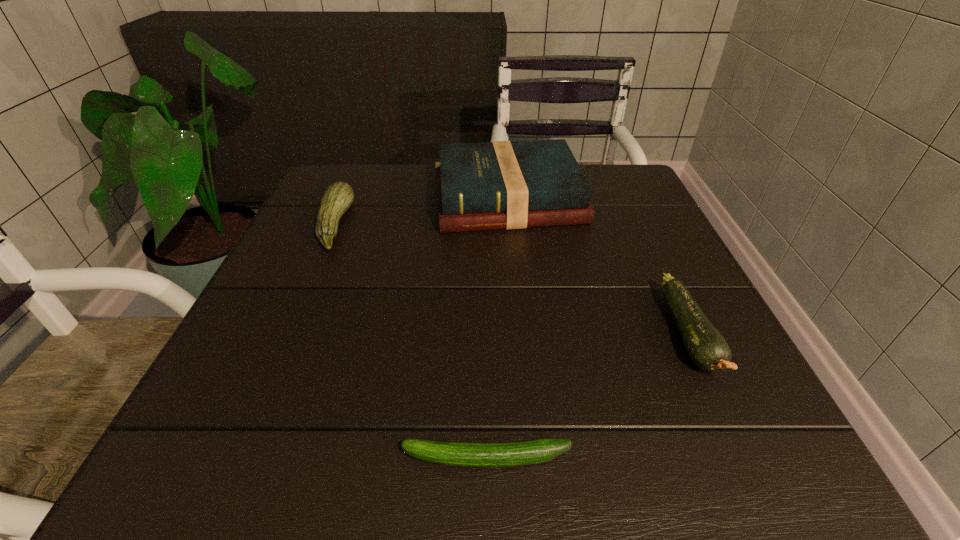
Where is `free space located 0.310m on the front-facing side of the shortest object`? free space located 0.310m on the front-facing side of the shortest object is located at coordinates coord(164,458).

At what (x,y) coordinates should I click in order to perform the action: click on blank area located on the front-facing side of the shortest object. Please return your answer as a coordinate pair (x, y). The height and width of the screenshot is (540, 960). Looking at the image, I should click on (210, 458).

At what (x,y) coordinates should I click in order to perform the action: click on free region located on the front-facing side of the shortest object. Please return your answer as a coordinate pair (x, y). This screenshot has height=540, width=960. Looking at the image, I should click on (195, 458).

At what (x,y) coordinates should I click in order to perform the action: click on hardback book that is positioned at the far edge. Please return your answer as a coordinate pair (x, y). Looking at the image, I should click on (493, 185).

Image resolution: width=960 pixels, height=540 pixels. I want to click on zucchini that is at the far edge, so pyautogui.click(x=338, y=197).

Find the location of a particular element. The height and width of the screenshot is (540, 960). object at the near edge is located at coordinates (507, 454).

At what (x,y) coordinates should I click in order to perform the action: click on object that is at the left edge. Please return your answer as a coordinate pair (x, y). The image size is (960, 540). Looking at the image, I should click on (338, 197).

Identify the location of hardback book that is at the right edge. (493, 185).

The height and width of the screenshot is (540, 960). Find the location of `zucchini that is at the right edge`. zucchini that is at the right edge is located at coordinates (707, 348).

Locate an element on the screen. This screenshot has width=960, height=540. object situated at the far left corner is located at coordinates (338, 197).